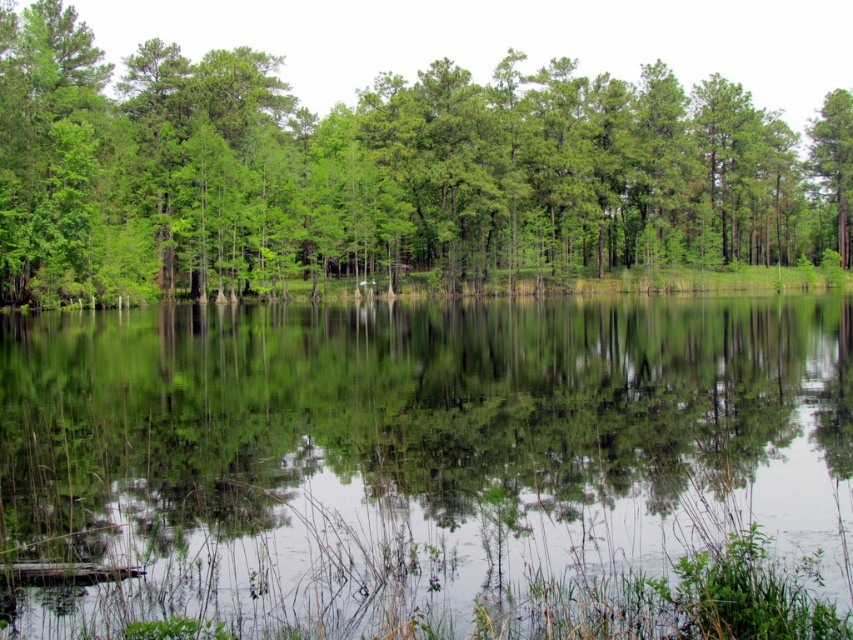
Question: Can you confirm if clear water at center is bigger than green leafy tree at center?

Choices:
 (A) yes
 (B) no

Answer: (B)

Question: Which point appears farthest from the camera in this image?

Choices:
 (A) (294, 605)
 (B) (613, 145)

Answer: (B)

Question: Can you confirm if clear water at center is positioned below green leafy tree at center?

Choices:
 (A) yes
 (B) no

Answer: (A)

Question: Among these objects, which one is farthest from the camera?

Choices:
 (A) clear water at center
 (B) green leafy tree at center

Answer: (B)

Question: Is clear water at center below green leafy tree at center?

Choices:
 (A) yes
 (B) no

Answer: (A)